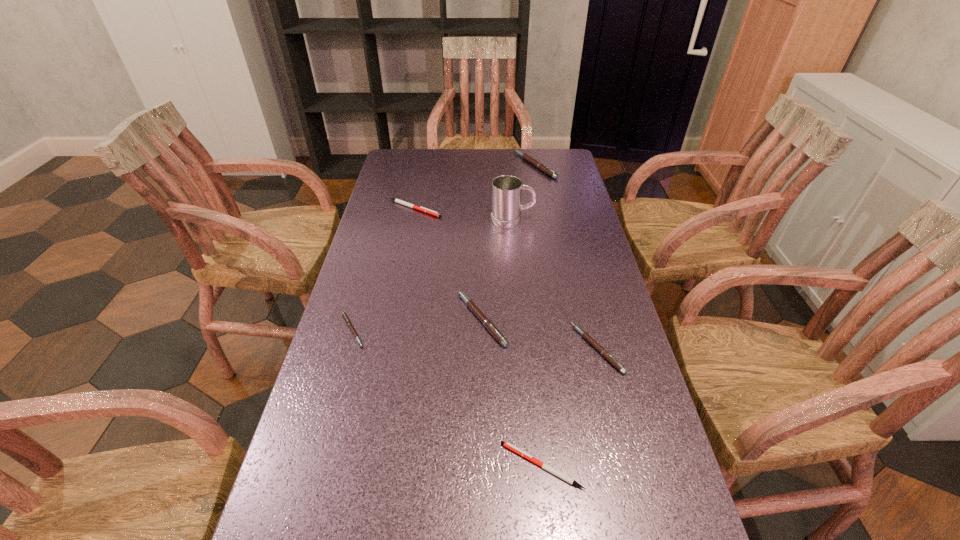
Locate an element on the screen. The image size is (960, 540). free region at the left edge of the desktop is located at coordinates (323, 451).

Image resolution: width=960 pixels, height=540 pixels. Find the location of `free location at the right edge`. free location at the right edge is located at coordinates (592, 293).

You are a GUI agent. You are given a task and a screenshot of the screen. Output one action in this format:
    pyautogui.click(x=<x>, y=<y>)
    Task: Click on the vacant space at the far left corner of the desktop
    
    Given the screenshot: What is the action you would take?
    pyautogui.click(x=426, y=162)

Find the location of a particular element. The width and height of the screenshot is (960, 540). vacant area between the second smallest pink pen and the farther white pen is located at coordinates (506, 279).

Locate an element on the screen. This screenshot has width=960, height=540. free spot between the second smallest pink pen and the right white pen is located at coordinates point(569,407).

Locate an element on the screen. unoccupied position between the smallest pink pen and the third pink pen from right to left is located at coordinates pos(417,325).

Locate an element on the screen. free space between the smallest pink pen and the nearer white pen is located at coordinates (446, 398).

Locate an element on the screen. The image size is (960, 540). vacant area that lies between the second biggest pink pen and the fifth nearest pen is located at coordinates (448, 264).

Where is `free spot between the second pink pen from left to right and the biggest pink pen`? Image resolution: width=960 pixels, height=540 pixels. free spot between the second pink pen from left to right and the biggest pink pen is located at coordinates (509, 242).

Where is `vacant point located between the farthest pink pen and the gray mug`? This screenshot has height=540, width=960. vacant point located between the farthest pink pen and the gray mug is located at coordinates (524, 193).